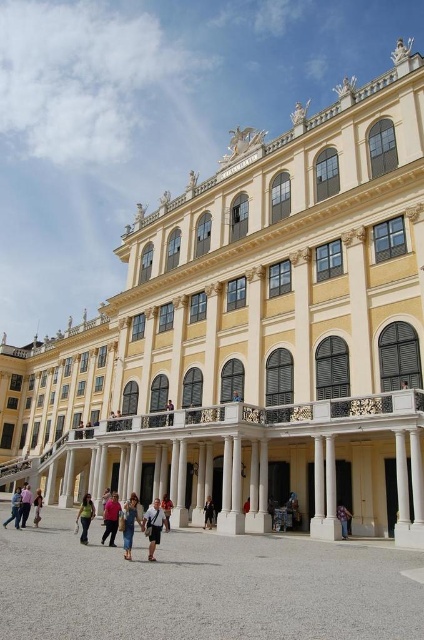
Question: Does purple cotton shirt at lower center come behind light brown leather bag at center?

Choices:
 (A) no
 (B) yes

Answer: (A)

Question: Does light brown leather jacket at center come in front of light brown leather bag at center?

Choices:
 (A) yes
 (B) no

Answer: (A)

Question: Among these points, which one is farthest from the camera?

Choices:
 (A) (25, 492)
 (B) (142, 525)

Answer: (A)

Question: Is blue denim dress at center positioned behind light brown leather bag at center?

Choices:
 (A) no
 (B) yes

Answer: (A)

Question: Which of these objects is positioned closest to the pink fabric dress at lower left?

Choices:
 (A) light brown leather bag at center
 (B) light brown leather jacket at center
 (C) blue denim dress at center
 (D) blue denim jeans at lower left

Answer: (D)

Question: Estimate the real-world distances between objects in this image. Which object is closer to the light brown leather bag at center?

Choices:
 (A) light brown wooden chair at center
 (B) blue denim jeans at lower left
 (C) pink fabric dress at lower left

Answer: (A)